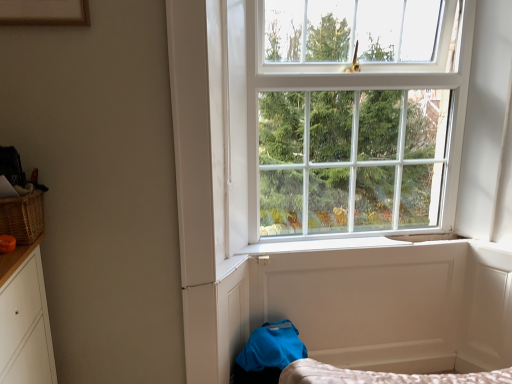
Question: Considering the positions of woven brown basket at left and white smooth window sill at center in the image, is woven brown basket at left taller or shorter than white smooth window sill at center?

Choices:
 (A) tall
 (B) short

Answer: (A)

Question: Looking at their shapes, would you say woven brown basket at left is wider or thinner than white smooth window sill at center?

Choices:
 (A) wide
 (B) thin

Answer: (A)

Question: Based on their relative distances, which object is nearer to the white wooden window at upper center?

Choices:
 (A) white smooth window sill at center
 (B) woven brown basket at left
 (C) wooden picture frame at upper left

Answer: (A)

Question: Estimate the real-world distances between objects in this image. Which object is farther from the white wooden window at upper center?

Choices:
 (A) wooden picture frame at upper left
 (B) white smooth window sill at center
 (C) woven brown basket at left

Answer: (C)